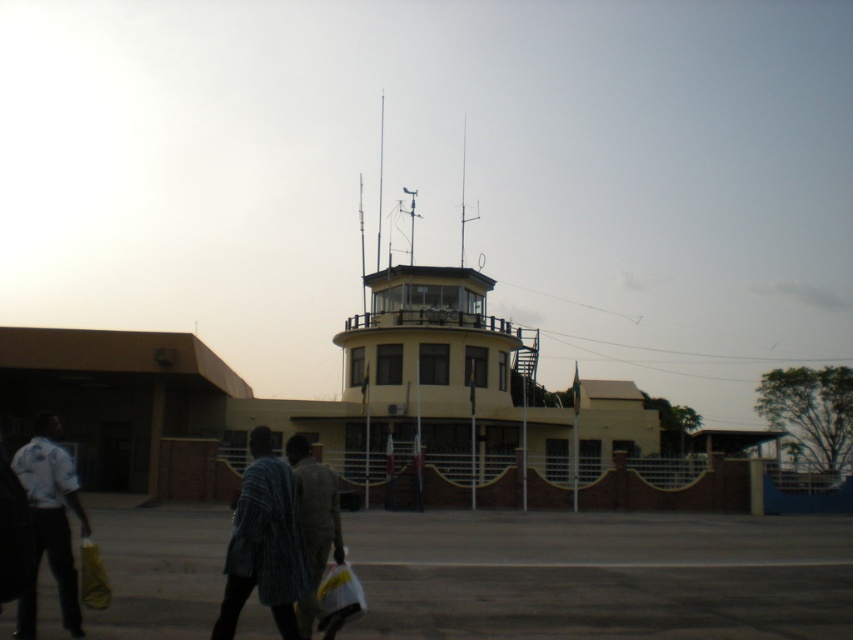
You are standing at the entrance of the control tower and want to find the striped fabric couple at center. Which direction should you go to reach them?

The striped fabric couple at center is located at point 0.838 on the x axis and 0.328 on the y axis, so you should move forward and to the right from the control tower entrance to reach them.

You are standing at the control tower and want to take a photo of the two points marked in the image. Which point, point (271, 547) or point (296, 452), will appear larger in your photo?

Point (271, 547) will appear larger in the photo because it is closer to the camera than point (296, 452).

You are an airport security officer standing at the control tower. You notice two items on the ground at the center of the scene. Which item is positioned higher relative to the other? The striped fabric couple at center or the light brown fabric jacket at center?

The striped fabric couple at center is above the light brown fabric jacket at center, so the striped fabric couple at center is positioned higher.